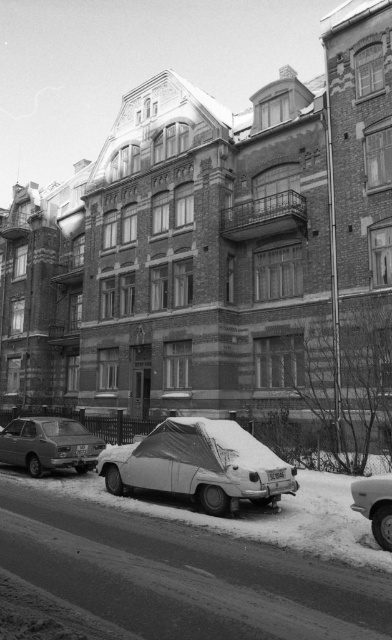
You are standing at the point with coordinates point (355, 483) and want to walk to the point with coordinates point (65, 429). Which direction should you move in to reach your destination?

You should move forward because point (65, 429) is behind point (355, 483), meaning it is in the direction you are facing.

You are standing at the entrance of the residential building and want to park your car. The parking spot you want is located at point [49,444]. What type of car is currently parked there?

The point [49,444] corresponds to the matte silver sedan at lower left, so the matte silver sedan at lower left is parked there.